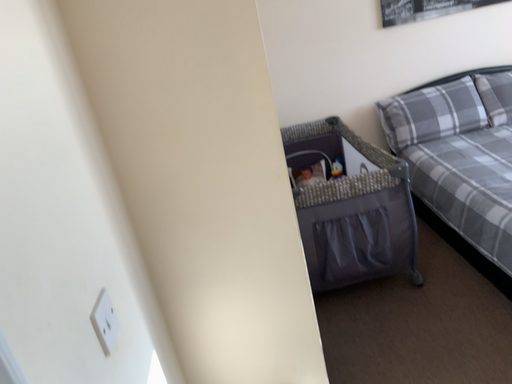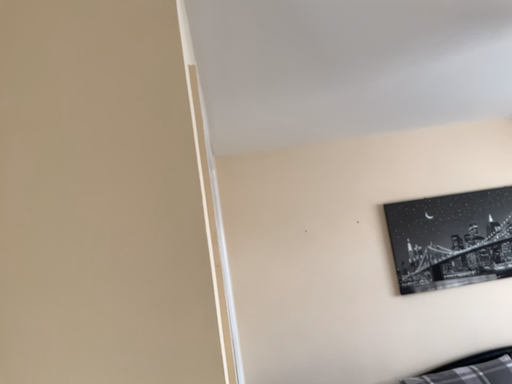
Question: How did the camera likely rotate when shooting the video?

Choices:
 (A) rotated downward
 (B) rotated upward

Answer: (B)